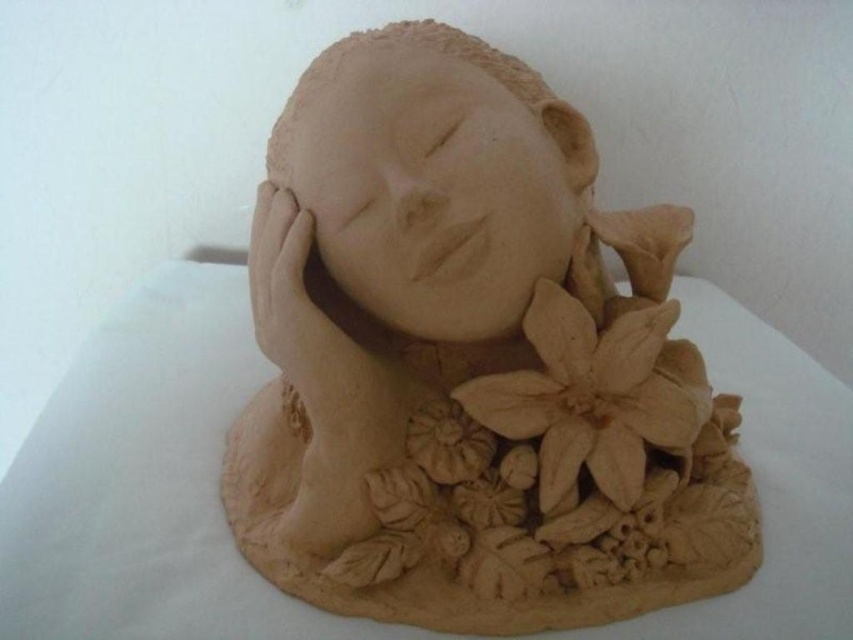
Question: Which point is farther from the camera taking this photo?

Choices:
 (A) 567,426
 (B) 479,452

Answer: (B)

Question: Does matte clay sculpture at center have a greater width compared to brown matte flower at center-right?

Choices:
 (A) no
 (B) yes

Answer: (B)

Question: Does brown matte flower at center-right have a smaller size compared to matte clay hand at center?

Choices:
 (A) no
 (B) yes

Answer: (A)

Question: Among these objects, which one is nearest to the camera?

Choices:
 (A) matte clay sculpture at center
 (B) brown matte flower at center-right
 (C) matte clay head at center

Answer: (C)

Question: Can you confirm if matte clay head at center is wider than matte clay hand at center?

Choices:
 (A) no
 (B) yes

Answer: (B)

Question: Which of the following is the farthest from the observer?

Choices:
 (A) (483, 440)
 (B) (579, 461)

Answer: (A)